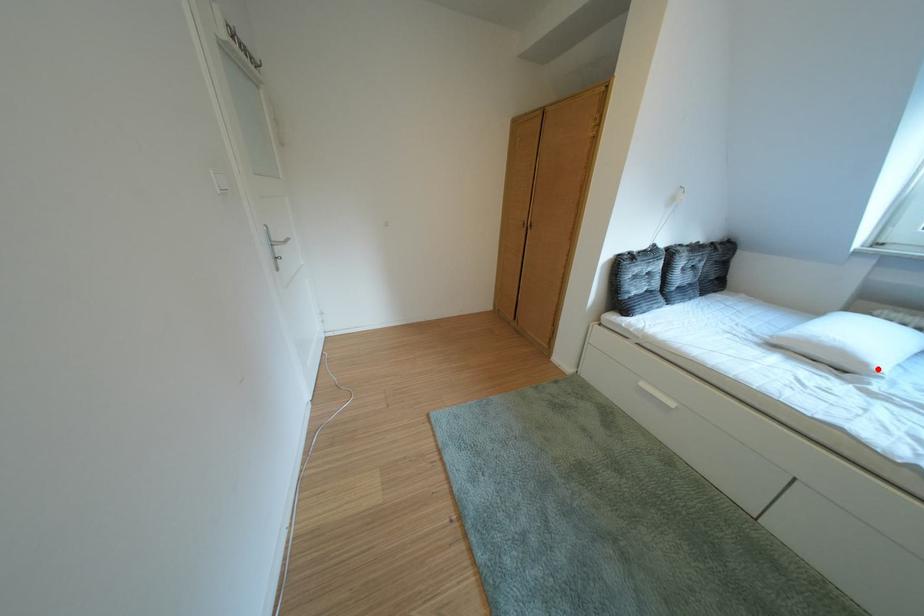
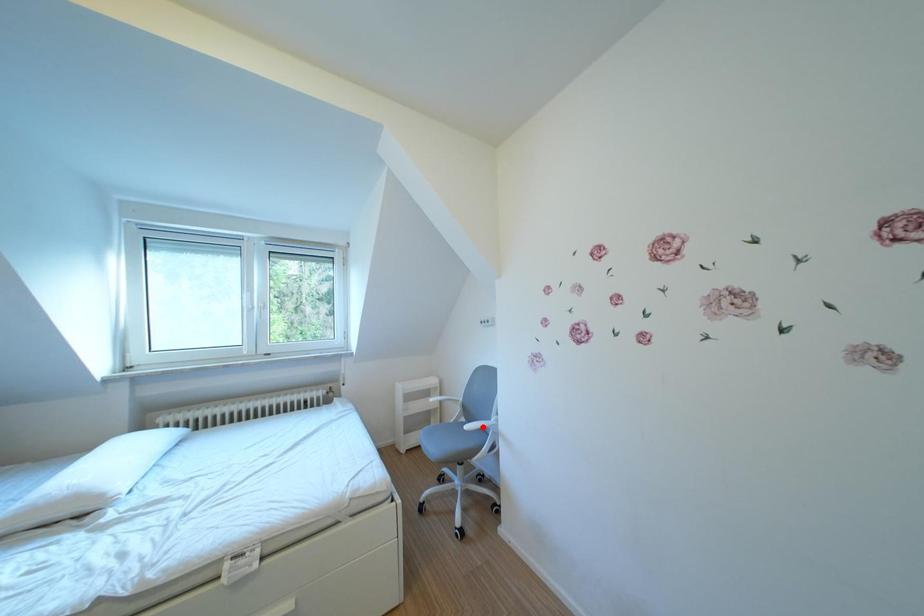
I am providing you with two images of the same scene from different viewpoints. A red point is marked on the first image and another point is marked on the second image. Is the marked point in image1 the same physical position as the marked point in image2?

No